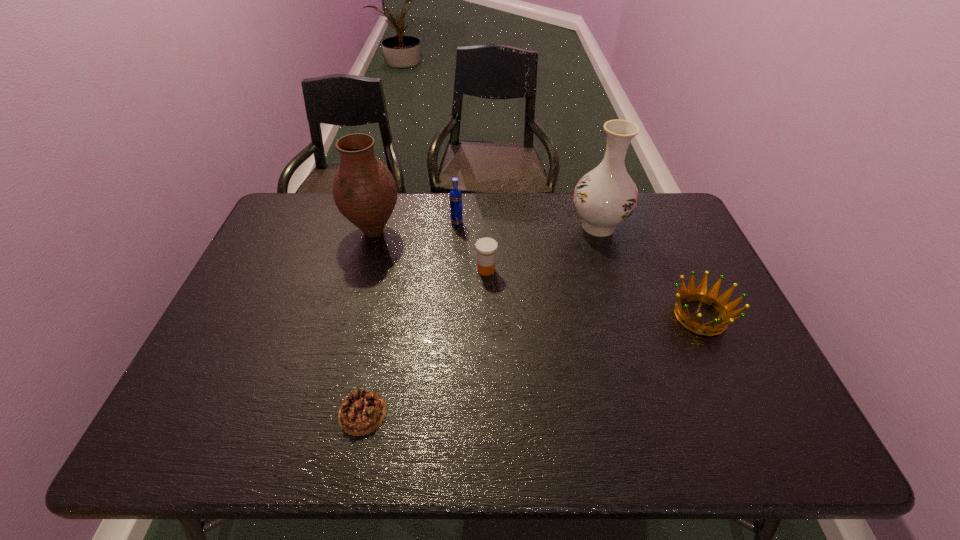
At what (x,y) coordinates should I click in order to perform the action: click on vacant space that's between the right vase and the left vase. Please return your answer as a coordinate pair (x, y). This screenshot has width=960, height=540. Looking at the image, I should click on (486, 229).

Locate an element on the screen. The image size is (960, 540). vacant space that is in between the right vase and the medicine is located at coordinates pos(542,248).

At what (x,y) coordinates should I click in order to perform the action: click on vacant space that is in between the left vase and the crown. Please return your answer as a coordinate pair (x, y). Image resolution: width=960 pixels, height=540 pixels. Looking at the image, I should click on (537, 274).

The image size is (960, 540). Find the location of `free spot between the fifth object from left to right and the left vase`. free spot between the fifth object from left to right and the left vase is located at coordinates (486, 229).

Find the location of `free point between the third object from left to right and the fifth object from left to right`. free point between the third object from left to right and the fifth object from left to right is located at coordinates (528, 225).

Identify which object is located as the fifth nearest to the crown. Please provide its 2D coordinates. Your answer should be formatted as a tuple, i.e. [(x, y)], where the tuple contains the x and y coordinates of a point satisfying the conditions above.

[(364, 190)]

Image resolution: width=960 pixels, height=540 pixels. What are the coordinates of `object that ranks as the fourth closest to the chocolate cake` in the screenshot? It's located at (606, 196).